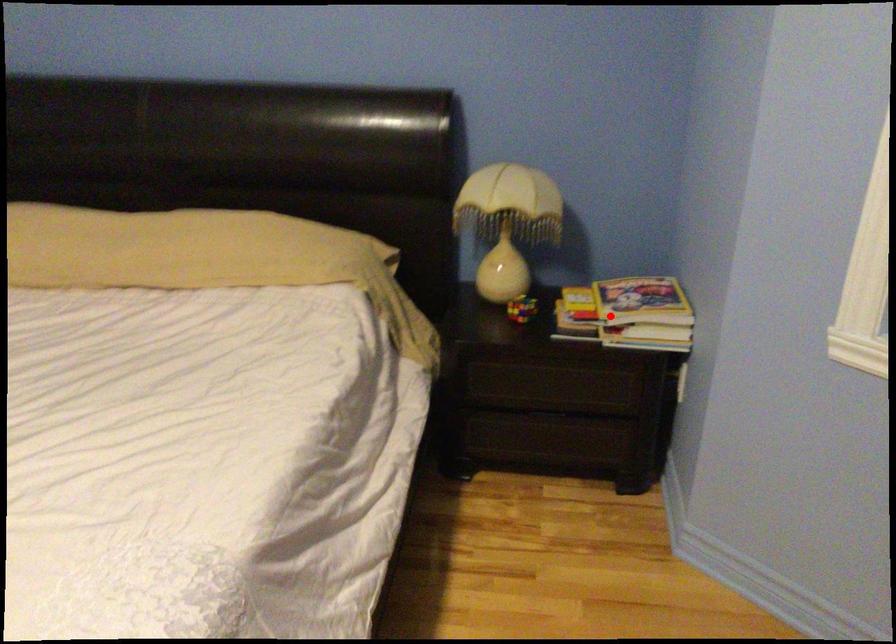
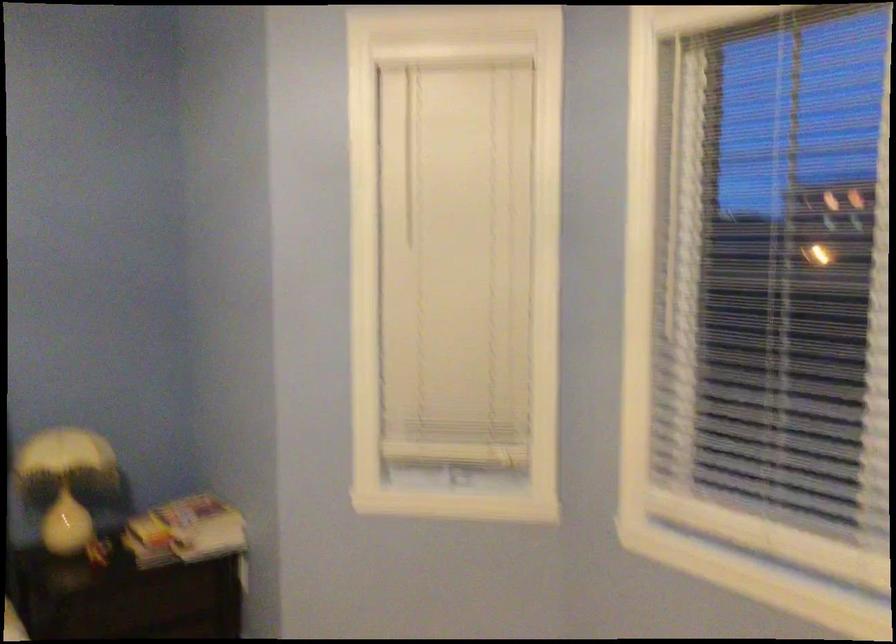
Find the pixel in the second image that matches the highlighted location in the first image.

(185, 532)